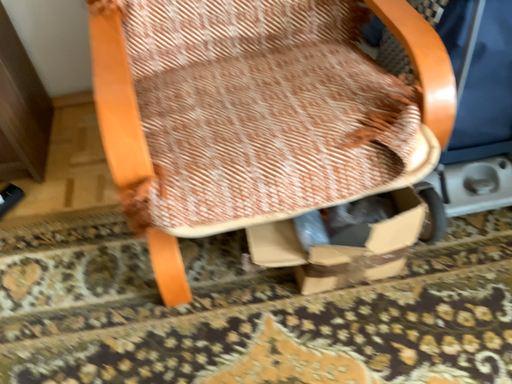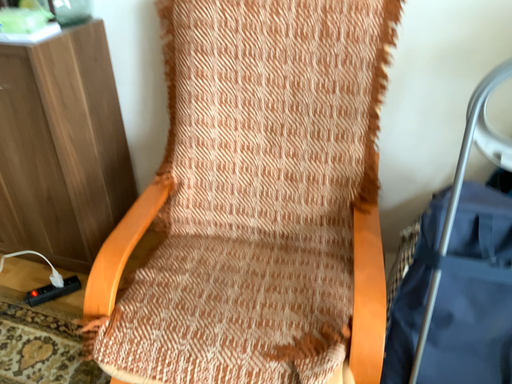
Question: Which way did the camera rotate in the video?

Choices:
 (A) rotated right
 (B) rotated left

Answer: (B)